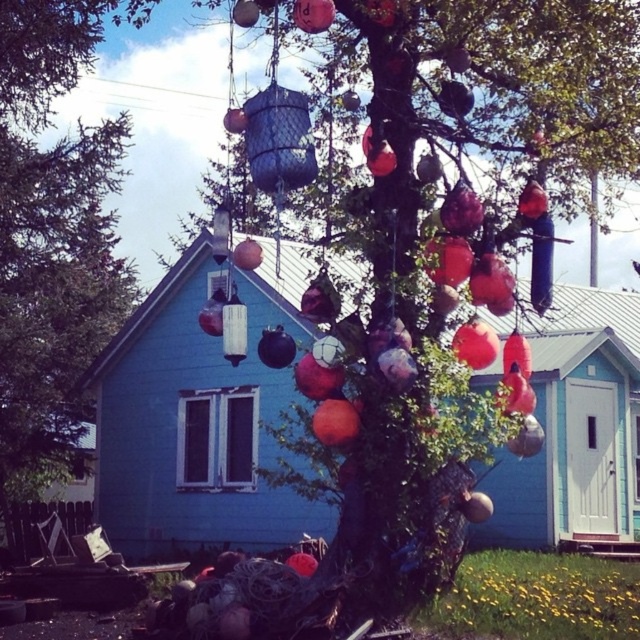
Which is above, metallic mesh basket at center or green matte tree at center?

green matte tree at center

Between point (339, 572) and point (52, 305), which one is positioned in front?

Point (339, 572)

Where is `metallic mesh basket at center`? The image size is (640, 640). metallic mesh basket at center is located at coordinates (426, 276).